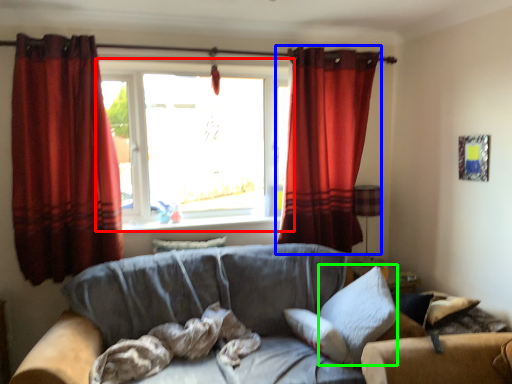
Question: Considering the real-world distances, which object is farthest from window (highlighted by a red box)? curtain (highlighted by a blue box) or pillow (highlighted by a green box)?

Choices:
 (A) curtain
 (B) pillow

Answer: (B)